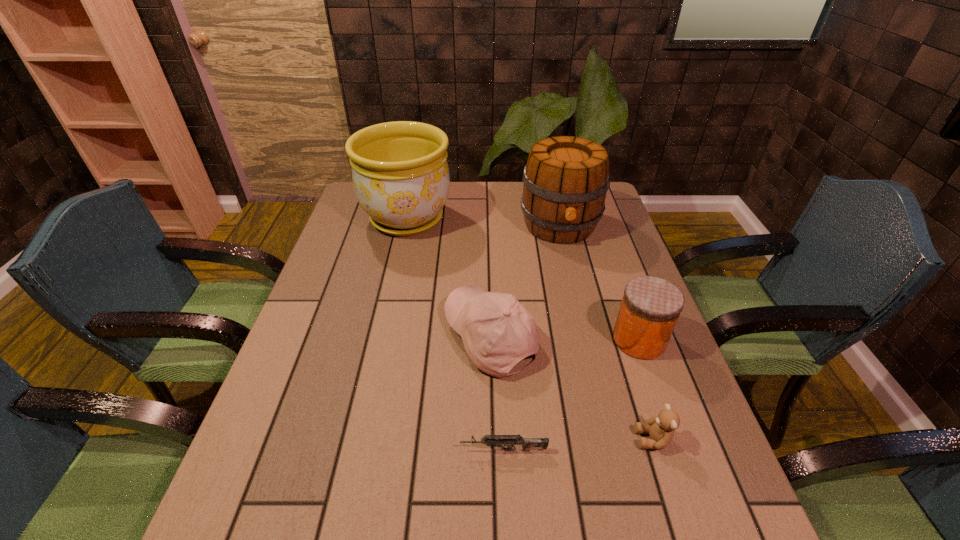
This screenshot has height=540, width=960. Find the location of `object that can be found as the closest to the second shortest object`. object that can be found as the closest to the second shortest object is located at coordinates (650, 308).

The image size is (960, 540). Find the location of `the closest object to the jar`. the closest object to the jar is located at coordinates (661, 429).

Where is `blank area in the image that satisfies the following two spatial constraints: 1. on the side of the cider where the spigot is located; 2. on the front-facing side of the baseball cap`? The width and height of the screenshot is (960, 540). blank area in the image that satisfies the following two spatial constraints: 1. on the side of the cider where the spigot is located; 2. on the front-facing side of the baseball cap is located at coordinates (587, 338).

Locate an element on the screen. free spot that satisfies the following two spatial constraints: 1. on the front side of the jar; 2. aimed along the barrel of the shortest object is located at coordinates (679, 450).

Identify the location of vacant region that satisfies the following two spatial constraints: 1. on the side of the cider where the spigot is located; 2. on the front-facing side of the baseball cap. (587, 338).